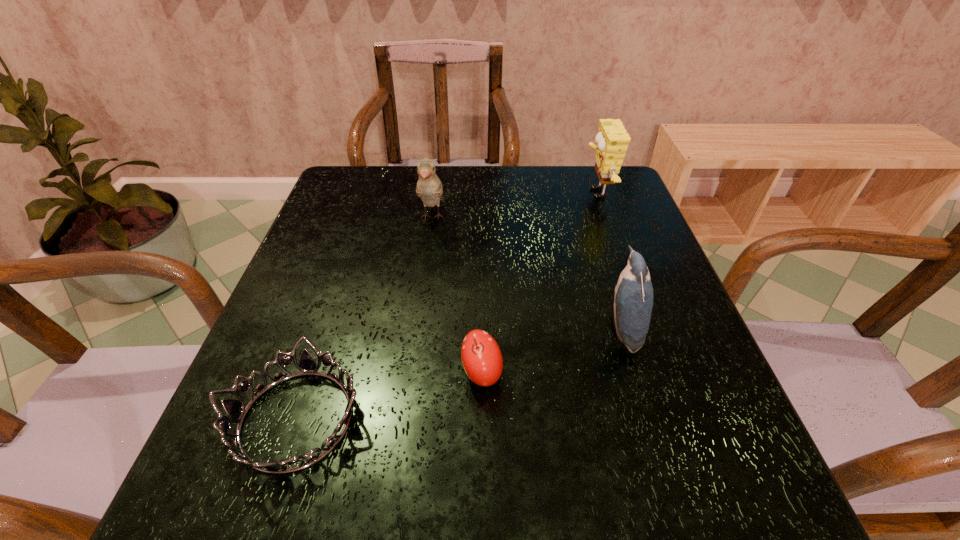
You are a GUI agent. You are given a task and a screenshot of the screen. Output one action in this format:
    pyautogui.click(x=<x>, y=<y>)
    Task: Click on the free location at the far right corner of the desktop
    
    Given the screenshot: What is the action you would take?
    pyautogui.click(x=619, y=203)

Identify the location of vacant space at the near right corner of the desktop. The height and width of the screenshot is (540, 960). (741, 492).

You are a GUI agent. You are given a task and a screenshot of the screen. Output one action in this format:
    pyautogui.click(x=<x>, y=<y>)
    Task: Click on the unoccupied area between the fourth tallest object and the sponge
    The image size is (960, 540).
    Given the screenshot: What is the action you would take?
    pyautogui.click(x=539, y=284)

You are a GUI agent. You are given a task and a screenshot of the screen. Output one action in this format:
    pyautogui.click(x=<x>, y=<y>)
    Task: Click on the vacant area between the fourth object from right to left and the shortest object
    Image resolution: width=960 pixels, height=540 pixels.
    Given the screenshot: What is the action you would take?
    pyautogui.click(x=364, y=318)

At what (x,y) coordinates should I click in order to perform the action: click on vacant region between the nearer bird and the left bird. Please return your answer as a coordinate pair (x, y). The height and width of the screenshot is (540, 960). Looking at the image, I should click on [526, 273].

Locate an element on the screen. The width and height of the screenshot is (960, 540). free space between the left bird and the tiara is located at coordinates (364, 318).

Identify the location of vacant space that is in between the farther bird and the sponge. (514, 205).

Where is `free spot between the tiara and the right bird`? The width and height of the screenshot is (960, 540). free spot between the tiara and the right bird is located at coordinates (459, 374).

Where is `free space between the sponge and the farther bird`? free space between the sponge and the farther bird is located at coordinates (514, 205).

This screenshot has width=960, height=540. In order to click on empty space between the shortest object and the right bird in this screenshot , I will do `click(459, 374)`.